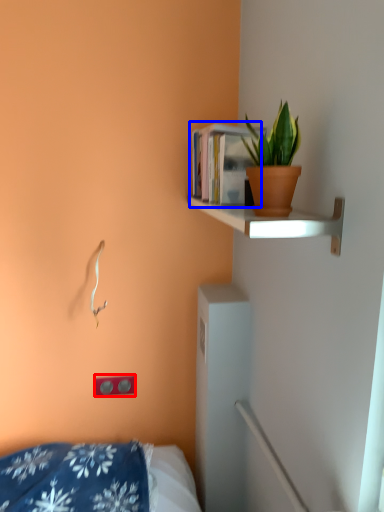
Question: Among these objects, which one is nearest to the camera, electric outlet (highlighted by a red box) or book (highlighted by a blue box)?

Choices:
 (A) electric outlet
 (B) book

Answer: (B)